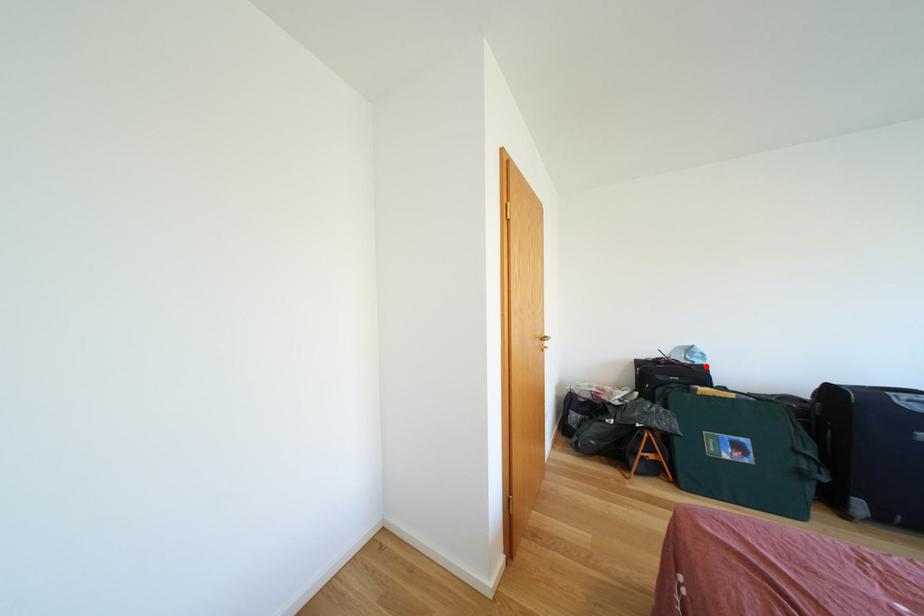
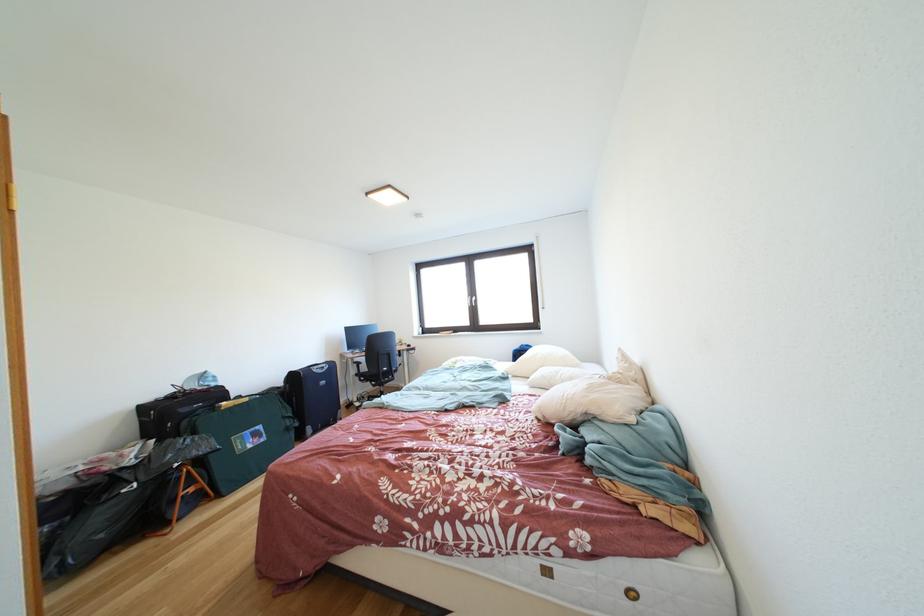
In the second image, find the point that corresponds to the highlighted location in the first image.

(222, 389)